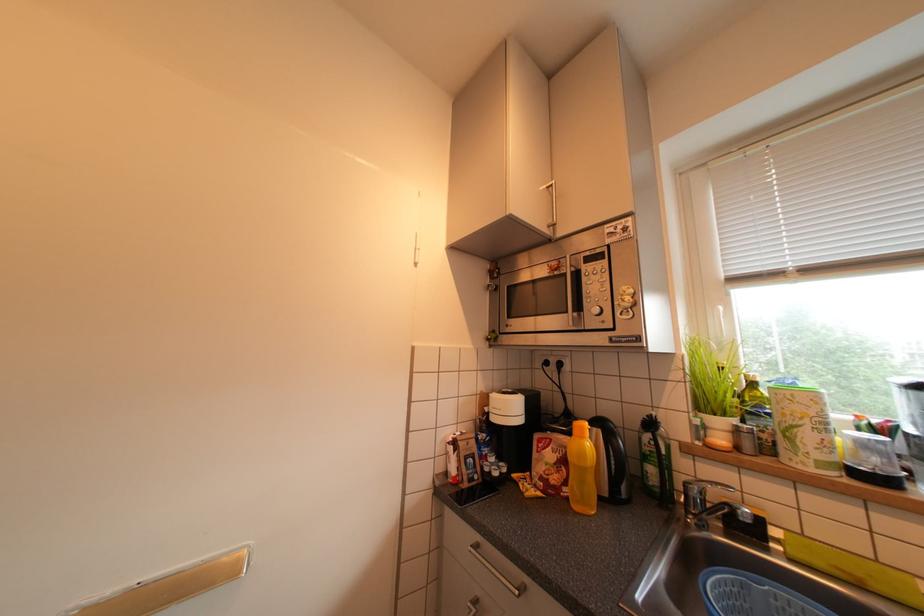
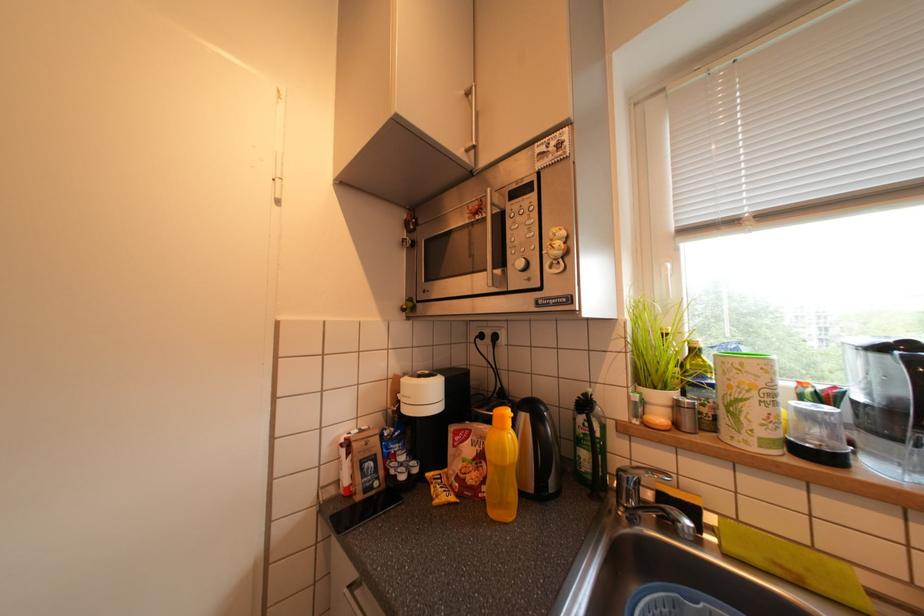
Which direction would the cameraman need to move to produce the second image?

The movement direction of the cameraman is right, forward.